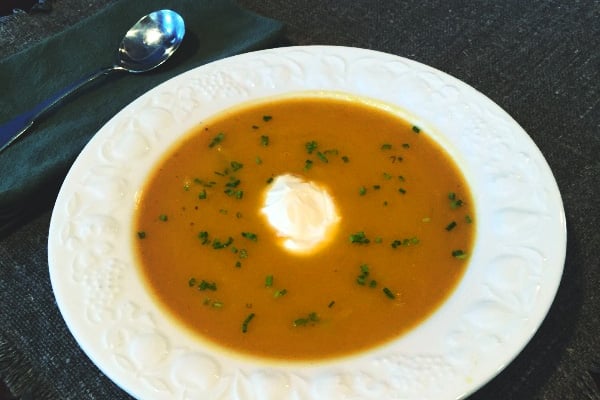
Find the location of a particular element. The height and width of the screenshot is (400, 600). cloth is located at coordinates (52, 146), (86, 112), (226, 22), (81, 33), (23, 65).